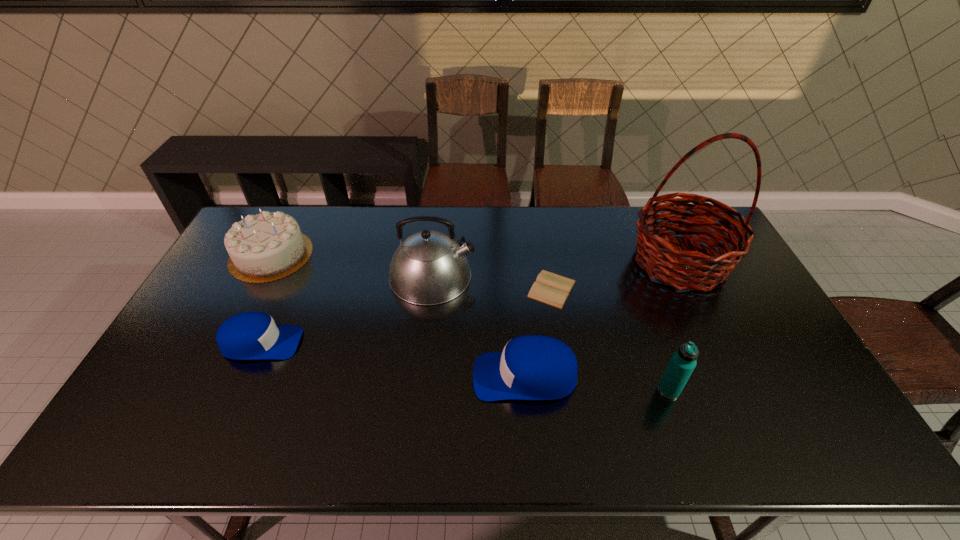
This screenshot has width=960, height=540. In order to click on empty location between the shorter baseball cap and the taller baseball cap in this screenshot , I will do `click(394, 360)`.

What are the coordinates of `the closest object to the left baseball cap` in the screenshot? It's located at (268, 246).

Locate an element on the screen. Image resolution: width=960 pixels, height=540 pixels. object that is the fourth nearest to the taller baseball cap is located at coordinates (683, 269).

The width and height of the screenshot is (960, 540). Identify the location of vacant area in the image that satisfies the following two spatial constraints: 1. on the front side of the diary; 2. on the left side of the water bottle. (568, 390).

I want to click on vacant region that satisfies the following two spatial constraints: 1. from the spout of the kettle; 2. on the left side of the fifth shortest object, so click(x=420, y=390).

I want to click on vacant region that satisfies the following two spatial constraints: 1. on the handle side of the tallest object; 2. on the front-facing side of the taller baseball cap, so click(x=735, y=376).

You are a GUI agent. You are given a task and a screenshot of the screen. Output one action in this format:
    pyautogui.click(x=<x>, y=<y>)
    Task: Click on the blank area in the image that satisfies the following two spatial constraints: 1. on the front side of the third tallest object; 2. on the right side of the diary
    The image size is (960, 540).
    Given the screenshot: What is the action you would take?
    pyautogui.click(x=568, y=390)

Where is `vacant space that satisfies the following two spatial constraints: 1. on the front side of the water bottle; 2. on the right side of the shortest object`? vacant space that satisfies the following two spatial constraints: 1. on the front side of the water bottle; 2. on the right side of the shortest object is located at coordinates (568, 390).